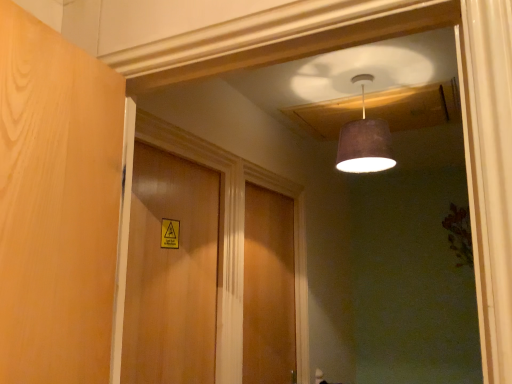
What do you see at coordinates (269, 288) in the screenshot?
I see `wooden door at center, the 2th door from the front` at bounding box center [269, 288].

Consider the image. In order to face matte brown lampshade at upper center, should I rotate leftwards or rightwards?

Turn right approximately 14.359 degrees to face it.

Identify the location of wooden door at center, placed as the second door when sorted from right to left. Image resolution: width=512 pixels, height=384 pixels. (170, 271).

I want to click on wooden door at center, the first door in the right-to-left sequence, so click(269, 288).

Between matte brown lampshade at upper center and wooden door at center, the first door positioned from the front, which one has more height?

wooden door at center, the first door positioned from the front, is taller.

Would you say matte brown lampshade at upper center contains wooden door at center, acting as the 2th door starting from the back?

Definitely not — wooden door at center, acting as the 2th door starting from the back, is not inside matte brown lampshade at upper center.

Between matte brown lampshade at upper center and wooden door at center, the first door positioned from the front, which one has smaller width?

wooden door at center, the first door positioned from the front.

Image resolution: width=512 pixels, height=384 pixels. What are the coordinates of `the 1st door below the matte brown lampshade at upper center (from a real-world perspective)` in the screenshot? It's located at (170, 271).

Considering the sizes of wooden door at center, placed as the first door when sorted from back to front, and wooden door at center, placed as the second door when sorted from right to left, in the image, is wooden door at center, placed as the first door when sorted from back to front, taller or shorter than wooden door at center, placed as the second door when sorted from right to left,?

wooden door at center, placed as the first door when sorted from back to front, is taller than wooden door at center, placed as the second door when sorted from right to left.

Considering the positions of objects wooden door at center, placed as the first door when sorted from back to front, and wooden door at center, the first door positioned from the front, in the image provided, who is more to the right, wooden door at center, placed as the first door when sorted from back to front, or wooden door at center, the first door positioned from the front,?

From the viewer's perspective, wooden door at center, placed as the first door when sorted from back to front, appears more on the right side.

From the image's perspective, is wooden door at center, the 2th door from the front, located above wooden door at center, placed as the second door when sorted from right to left?

Incorrect, from the image's perspective, wooden door at center, the 2th door from the front, is lower than wooden door at center, placed as the second door when sorted from right to left.

Is wooden door at center, placed as the first door when sorted from back to front, turned away from wooden door at center, acting as the 2th door starting from the back?

No.

From the image's perspective, which one is positioned lower, wooden door at center, acting as the 2th door starting from the back, or matte brown lampshade at upper center?

wooden door at center, acting as the 2th door starting from the back, appears lower in the image.

Who is more distant, wooden door at center, placed as the second door when sorted from right to left, or matte brown lampshade at upper center?

Positioned behind is matte brown lampshade at upper center.

How many degrees apart are the facing directions of wooden door at center, the first door positioned from the front, and matte brown lampshade at upper center?

The angular difference between wooden door at center, the first door positioned from the front, and matte brown lampshade at upper center is 92.8 degrees.

Considering the relative sizes of wooden door at center, the first door positioned from the front, and matte brown lampshade at upper center in the image provided, is wooden door at center, the first door positioned from the front, wider than matte brown lampshade at upper center?

Incorrect, the width of wooden door at center, the first door positioned from the front, does not surpass that of matte brown lampshade at upper center.

From a real-world perspective, between wooden door at center, placed as the second door when sorted from right to left, and wooden door at center, the first door in the right-to-left sequence, who is vertically lower?

wooden door at center, the first door in the right-to-left sequence, is physically lower.

Is the position of wooden door at center, the first door positioned from the front, more distant than that of wooden door at center, the first door in the right-to-left sequence?

No, it is in front of wooden door at center, the first door in the right-to-left sequence.

From the picture: Who is bigger, wooden door at center, placed as the second door when sorted from right to left, or wooden door at center, placed as the first door when sorted from back to front?

With larger size is wooden door at center, placed as the first door when sorted from back to front.

From a real-world perspective, who is located lower, matte brown lampshade at upper center or wooden door at center, arranged as the second door when viewed from the left?

In real-world perspective, wooden door at center, arranged as the second door when viewed from the left, is lower.

In the image, is matte brown lampshade at upper center on the left side or the right side of wooden door at center, the 2th door from the front?

Based on their positions, matte brown lampshade at upper center is located to the right of wooden door at center, the 2th door from the front.

Is matte brown lampshade at upper center completely or partially outside of wooden door at center, the 2th door from the front?

Yes, matte brown lampshade at upper center is outside of wooden door at center, the 2th door from the front.

Does matte brown lampshade at upper center have a greater height compared to wooden door at center, the first door in the right-to-left sequence?

In fact, matte brown lampshade at upper center may be shorter than wooden door at center, the first door in the right-to-left sequence.

Which object is more forward, wooden door at center, placed as the first door when sorted from back to front, or matte brown lampshade at upper center?

matte brown lampshade at upper center.

Based on the photo, is wooden door at center, placed as the first door when sorted from back to front, touching matte brown lampshade at upper center?

No, wooden door at center, placed as the first door when sorted from back to front, is not with matte brown lampshade at upper center.

From the image's perspective, is wooden door at center, placed as the first door when sorted from back to front, above matte brown lampshade at upper center?

Incorrect, from the image's perspective, wooden door at center, placed as the first door when sorted from back to front, is lower than matte brown lampshade at upper center.

From the image's perspective, starting from the matte brown lampshade at upper center, which door is the 1st one below? Please provide its 2D coordinates.

[(170, 271)]

Identify the location of door on the left of wooden door at center, the first door in the right-to-left sequence. (170, 271).

Looking at this image, when comparing their distances from matte brown lampshade at upper center, does wooden door at center, the 2th door from the front, or wooden door at center, the first door positioned from the front, seem closer?

The object closer to matte brown lampshade at upper center is wooden door at center, the first door positioned from the front.

Looking at the image, which one is located further to wooden door at center, arranged as the second door when viewed from the left, wooden door at center, placed as the second door when sorted from right to left, or matte brown lampshade at upper center?

matte brown lampshade at upper center.

From the picture: When comparing their distances from wooden door at center, the first door viewed from the left, does matte brown lampshade at upper center or wooden door at center, arranged as the second door when viewed from the left, seem closer?

wooden door at center, arranged as the second door when viewed from the left.

Estimate the real-world distances between objects in this image. Which object is further from wooden door at center, acting as the 2th door starting from the back, wooden door at center, the 2th door from the front, or matte brown lampshade at upper center?

matte brown lampshade at upper center is further to wooden door at center, acting as the 2th door starting from the back.

Which object lies nearer to the anchor point matte brown lampshade at upper center, wooden door at center, the first door viewed from the left, or wooden door at center, arranged as the second door when viewed from the left?

Among the two, wooden door at center, the first door viewed from the left, is located nearer to matte brown lampshade at upper center.

Looking at the image, which one is located further to wooden door at center, placed as the first door when sorted from back to front, matte brown lampshade at upper center or wooden door at center, the first door positioned from the front?

Based on the image, matte brown lampshade at upper center appears to be further to wooden door at center, placed as the first door when sorted from back to front.

I want to click on door between matte brown lampshade at upper center and wooden door at center, the 2th door from the front, vertically, so click(170, 271).